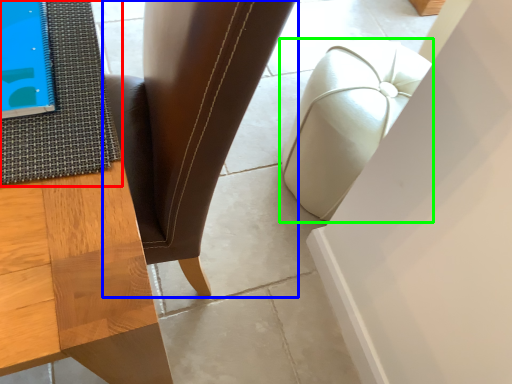
Question: Based on their relative distances, which object is farther from mat (highlighted by a red box)? Choose from chair (highlighted by a blue box) and furniture (highlighted by a green box).

Choices:
 (A) chair
 (B) furniture

Answer: (B)